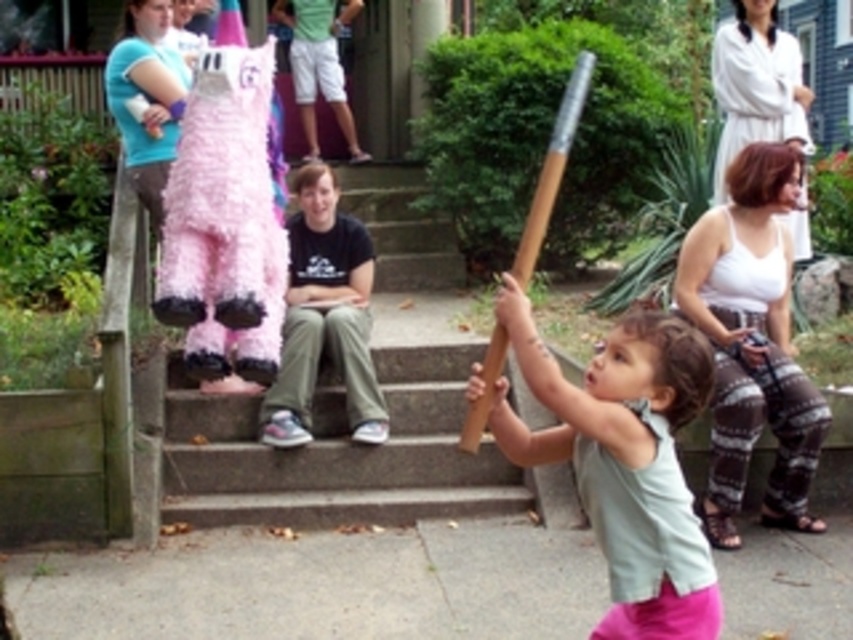
Question: Based on their relative distances, which object is nearer to the brown wooden bat at center?

Choices:
 (A) light green fabric shirt at center
 (B) matte pink piñata at upper left

Answer: (A)

Question: Is light green fabric shirt at center below brown wooden bat at center?

Choices:
 (A) no
 (B) yes

Answer: (B)

Question: Which point is closer to the camera taking this photo?

Choices:
 (A) (137, 150)
 (B) (541, 216)
 (C) (688, 268)
 (D) (701, 384)

Answer: (D)

Question: Can you confirm if white cotton tank top at upper right is thinner than brown wooden bat at center?

Choices:
 (A) yes
 (B) no

Answer: (B)

Question: Is light green fabric shirt at center closer to camera compared to brown wooden bat at center?

Choices:
 (A) no
 (B) yes

Answer: (B)

Question: Which of the following is the farthest from the observer?

Choices:
 (A) (715, 500)
 (B) (585, 60)
 (C) (113, 68)
 (D) (627, 563)

Answer: (C)